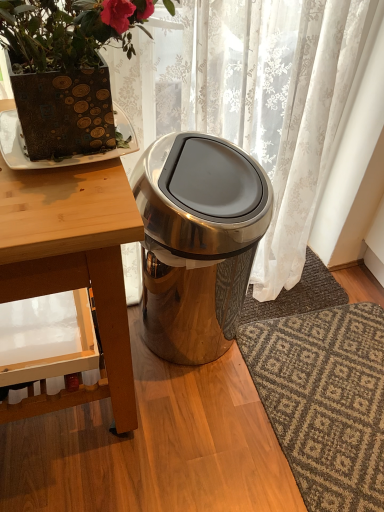
The height and width of the screenshot is (512, 384). What are the coordinates of `space that is in front of satin silver trash can at center` in the screenshot? It's located at (210, 434).